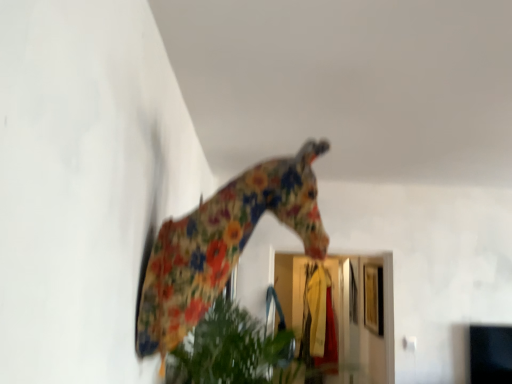
What do you see at coordinates (362, 317) in the screenshot? The height and width of the screenshot is (384, 512). I see `transparent glass door at center` at bounding box center [362, 317].

Where is `transparent glass door at center`? transparent glass door at center is located at coordinates (362, 317).

What is the approximate width of transparent glass door at center?

It is 5.71 inches.

What do you see at coordinates (223, 244) in the screenshot? The height and width of the screenshot is (384, 512). I see `floral fabric giraffe at center` at bounding box center [223, 244].

The width and height of the screenshot is (512, 384). I want to click on floral fabric giraffe at center, so click(x=223, y=244).

The image size is (512, 384). Find the location of `transparent glass door at center`. transparent glass door at center is located at coordinates [362, 317].

Can you confirm if transparent glass door at center is positioned to the left of floral fabric giraffe at center?

No, transparent glass door at center is not to the left of floral fabric giraffe at center.

Which object is further away from the camera taking this photo, transparent glass door at center or floral fabric giraffe at center?

transparent glass door at center is further away from the camera.

Which is behind, point (389, 378) or point (193, 298)?

The point (389, 378) is more distant.

From the image's perspective, is transparent glass door at center located above or below floral fabric giraffe at center?

transparent glass door at center is below floral fabric giraffe at center.

From a real-world perspective, is transparent glass door at center physically located above or below floral fabric giraffe at center?

transparent glass door at center is below floral fabric giraffe at center.

Between transparent glass door at center and floral fabric giraffe at center, which one has larger width?

Wider between the two is floral fabric giraffe at center.

Considering the sizes of transparent glass door at center and floral fabric giraffe at center in the image, is transparent glass door at center taller or shorter than floral fabric giraffe at center?

transparent glass door at center is taller than floral fabric giraffe at center.

Between transparent glass door at center and floral fabric giraffe at center, which one has smaller size?

With smaller size is transparent glass door at center.

Is transparent glass door at center completely or partially outside of floral fabric giraffe at center?

A: That's correct, transparent glass door at center is outside of floral fabric giraffe at center.

Are transparent glass door at center and floral fabric giraffe at center making contact?

No, transparent glass door at center is not next to floral fabric giraffe at center.

Is transparent glass door at center turned away from floral fabric giraffe at center?

No, floral fabric giraffe at center is not at the back of transparent glass door at center.

Can you tell me how much transparent glass door at center and floral fabric giraffe at center differ in facing direction?

The angle between the facing direction of transparent glass door at center and the facing direction of floral fabric giraffe at center is 90.4 degrees.

Where is `giraffe above the transparent glass door at center (from a real-world perspective)`? The height and width of the screenshot is (384, 512). giraffe above the transparent glass door at center (from a real-world perspective) is located at coordinates pos(223,244).

Considering the positions of objects floral fabric giraffe at center and transparent glass door at center in the image provided, who is more to the left, floral fabric giraffe at center or transparent glass door at center?

From the viewer's perspective, floral fabric giraffe at center appears more on the left side.

Which object is closer to the camera, floral fabric giraffe at center or transparent glass door at center?

floral fabric giraffe at center is in front.

Considering the points (205, 207) and (297, 342), which point is behind, point (205, 207) or point (297, 342)?

The point (297, 342) is more distant.

From the image's perspective, between floral fabric giraffe at center and transparent glass door at center, which one is located above?

From the image's view, floral fabric giraffe at center is above.

From a real-world perspective, which is physically above, floral fabric giraffe at center or transparent glass door at center?

floral fabric giraffe at center.

In terms of width, does floral fabric giraffe at center look wider or thinner when compared to transparent glass door at center?

Considering their sizes, floral fabric giraffe at center looks broader than transparent glass door at center.

Considering the sizes of objects floral fabric giraffe at center and transparent glass door at center in the image provided, who is taller, floral fabric giraffe at center or transparent glass door at center?

With more height is transparent glass door at center.

Between floral fabric giraffe at center and transparent glass door at center, which one has smaller size?

With smaller size is transparent glass door at center.

Is floral fabric giraffe at center inside or outside of transparent glass door at center?

floral fabric giraffe at center cannot be found inside transparent glass door at center.

Is floral fabric giraffe at center next to transparent glass door at center?

No, floral fabric giraffe at center is not with transparent glass door at center.

Is floral fabric giraffe at center oriented away from transparent glass door at center?

No, floral fabric giraffe at center is not facing the opposite direction of transparent glass door at center.

The width and height of the screenshot is (512, 384). In order to click on giraffe located above the transparent glass door at center (from a real-world perspective) in this screenshot , I will do `click(223, 244)`.

Locate an element on the screen. glass door behind the floral fabric giraffe at center is located at coordinates point(362,317).

At what (x,y) coordinates should I click in order to perform the action: click on giraffe lying in front of the transparent glass door at center. Please return your answer as a coordinate pair (x, y). The width and height of the screenshot is (512, 384). Looking at the image, I should click on 223,244.